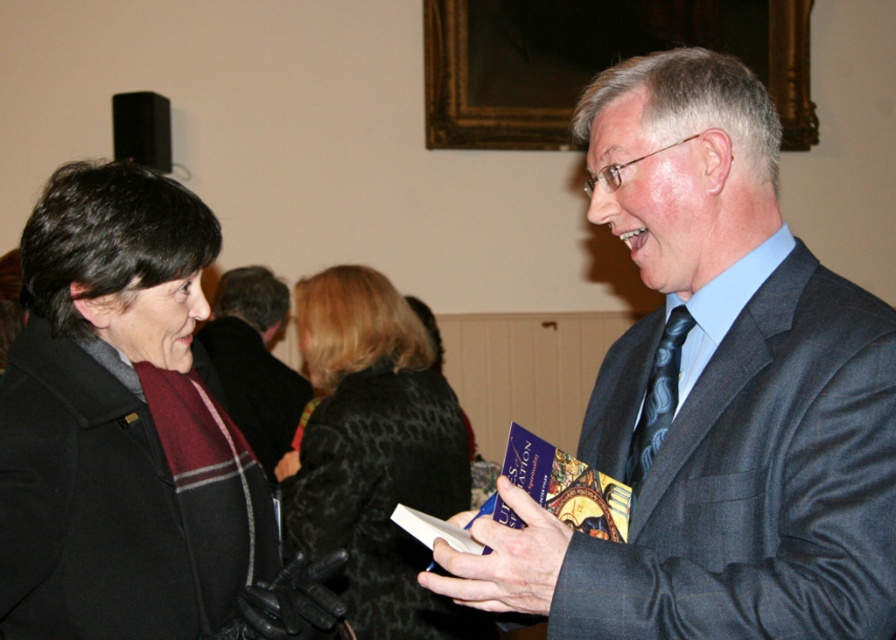
Is dark gray suit at center to the right of dark gray suit at right from the viewer's perspective?

Correct, you'll find dark gray suit at center to the right of dark gray suit at right.

At what (x,y) coordinates should I click in order to perform the action: click on dark gray suit at center. Please return your answer as a coordinate pair (x, y). Looking at the image, I should click on (713, 396).

Which is behind, point (685, 108) or point (214, 323)?

Positioned behind is point (214, 323).

Locate an element on the screen. This screenshot has width=896, height=640. dark gray suit at center is located at coordinates (713, 396).

Does black textured coat at center appear over dark gray suit at right?

No, black textured coat at center is not above dark gray suit at right.

Is black textured coat at center positioned before dark gray suit at right?

Yes, black textured coat at center is closer to the viewer.

Which is behind, point (402, 308) or point (276, 404)?

The point (276, 404) is behind.

Find the location of `black textured coat at center`. black textured coat at center is located at coordinates [x=375, y=452].

Does dark gray suit at center have a lesser height compared to black textured coat at center?

Correct, dark gray suit at center is not as tall as black textured coat at center.

Can you confirm if dark gray suit at center is taller than black textured coat at center?

No.

Who is more distant from viewer, (x=593, y=109) or (x=343, y=456)?

The point (x=343, y=456) is more distant.

This screenshot has height=640, width=896. I want to click on dark gray suit at center, so click(713, 396).